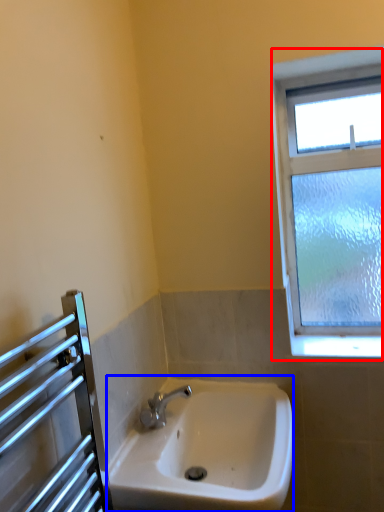
Question: Among these objects, which one is farthest to the camera, window (highlighted by a red box) or sink (highlighted by a blue box)?

Choices:
 (A) window
 (B) sink

Answer: (A)